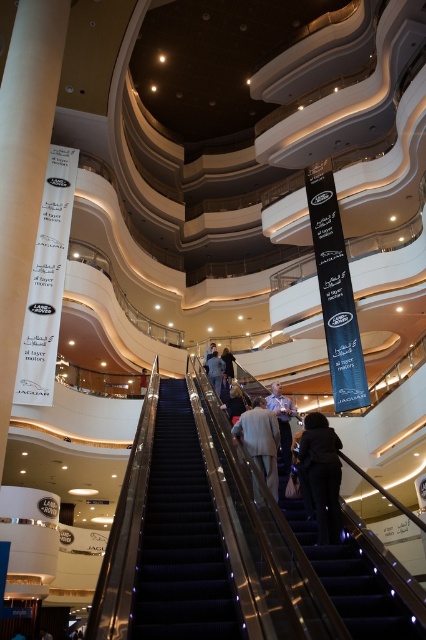
You are a delivery person carrying a package that requires a clear path of at least 10 meters between two items to pass through. You see the light blue shirt at center and the light beige fabric jacket at center. Can you pass through the space between them?

The light blue shirt at center and the light beige fabric jacket at center are 9.56 meters apart from each other. Since the required clear path is 10 meters, you cannot pass through the space between them as it is shorter than needed.

From the picture: You are a customer in the mall and you see the light blue shirt at center and the light beige fabric jacket at center hanging on a rack. Which one is closer to the ground?

The light blue shirt at center is positioned under the light beige fabric jacket at center, so it is closer to the ground.